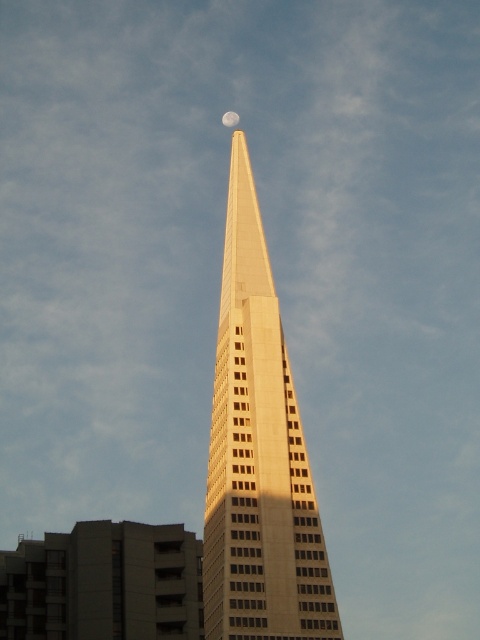
Consider the image. Is beige concrete skyscraper at center taller than silvery reflective moon at upper center?

Indeed, beige concrete skyscraper at center has a greater height compared to silvery reflective moon at upper center.

Between point (273, 506) and point (237, 124), which one is positioned in front?

Point (273, 506) is more forward.

Locate an element on the screen. This screenshot has width=480, height=640. beige concrete skyscraper at center is located at coordinates (259, 456).